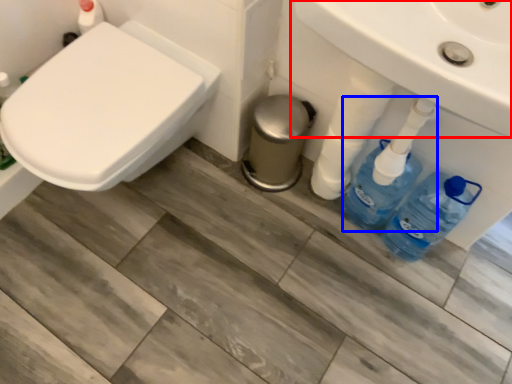
Question: Which point is closer to the camera, sink (highlighted by a red box) or cleaning product (highlighted by a blue box)?

Choices:
 (A) sink
 (B) cleaning product

Answer: (A)